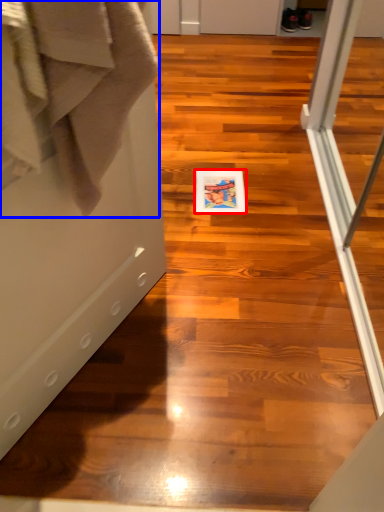
Question: Among these objects, which one is nearest to the camera, postcard (highlighted by a red box) or bath towel (highlighted by a blue box)?

Choices:
 (A) postcard
 (B) bath towel

Answer: (B)